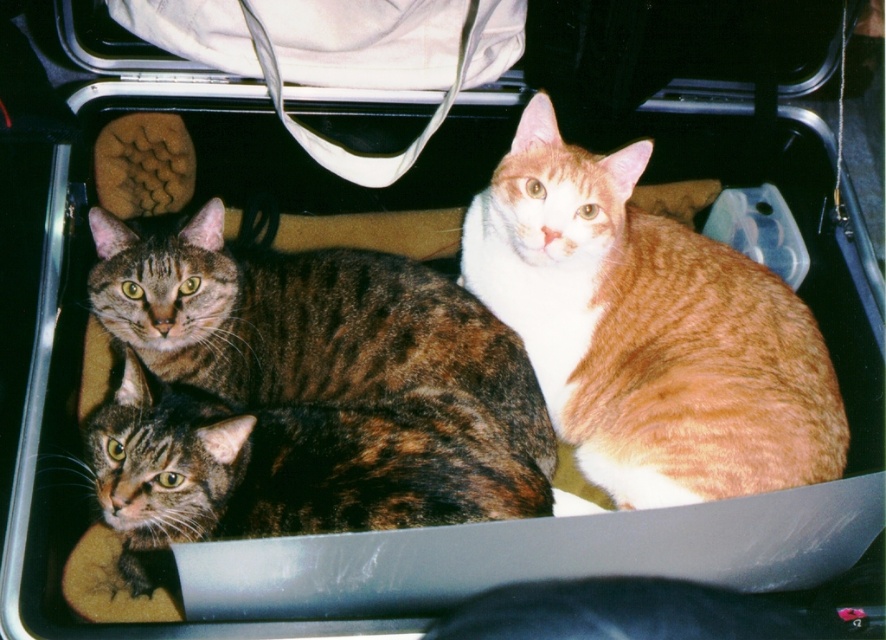
You are a veterinarian examining an image of two cats inside a car trunk. The cats are labeled as the orange tabby cat at center and the dark brown fur cat at center. Based on their positions, which cat is located above the other?

The dark brown fur cat at center is above the orange tabby cat at center because the orange tabby cat at center is positioned under the dark brown fur cat at center.

You are a cat owner trying to reach into the trunk to pet the dark brown fur cat at center. Given that your hand can extend 4 feet, will you be able to touch the cat?

The dark brown fur cat at center is 4.36 feet away from the viewer. Since your hand can only extend 4 feet, you will not be able to reach the cat.